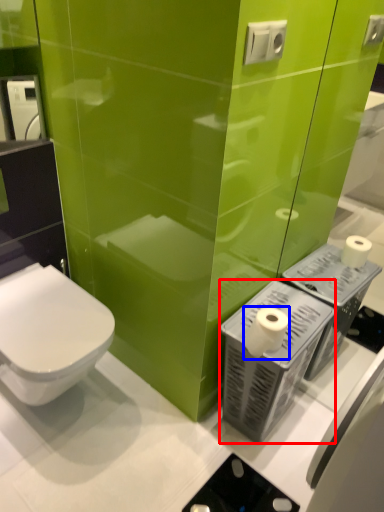
Question: Which object appears farthest to the camera in this image, appliance (highlighted by a red box) or toilet paper (highlighted by a blue box)?

Choices:
 (A) appliance
 (B) toilet paper

Answer: (A)